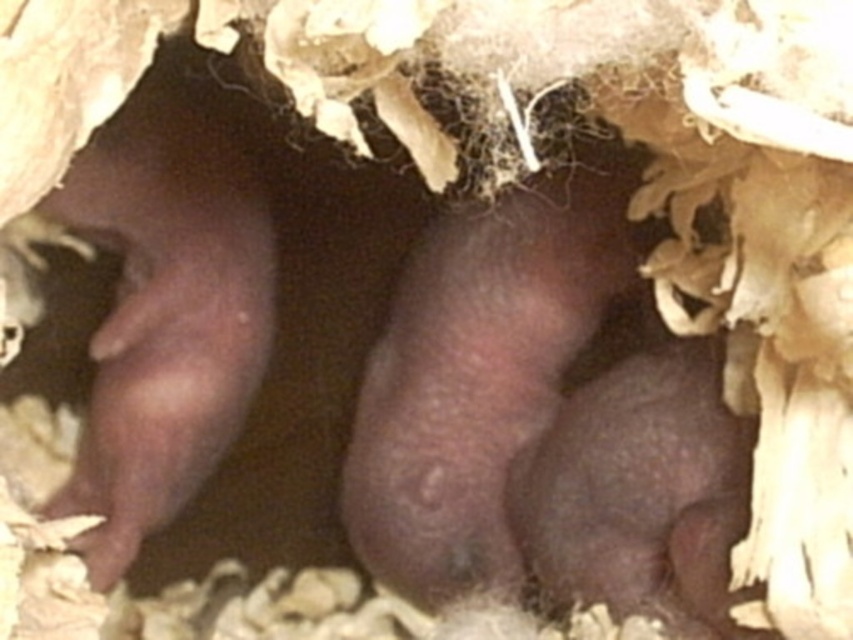
Question: Is fuzzy dark brown hamster at center in front of smooth dark brown hamster at left?

Choices:
 (A) no
 (B) yes

Answer: (B)

Question: Is smooth dark brown hamster at left to the right of fuzzy dark brown mouse at center from the viewer's perspective?

Choices:
 (A) yes
 (B) no

Answer: (B)

Question: Can you confirm if fuzzy dark brown hamster at center is wider than fuzzy dark brown mouse at center?

Choices:
 (A) yes
 (B) no

Answer: (A)

Question: Which point appears closest to the camera in this image?

Choices:
 (A) (236, 161)
 (B) (643, 388)

Answer: (B)

Question: Among these objects, which one is farthest from the camera?

Choices:
 (A) fuzzy dark brown mouse at center
 (B) smooth dark brown hamster at left

Answer: (B)

Question: Among these points, which one is farthest from the camera?

Choices:
 (A) (689, 624)
 (B) (436, 502)

Answer: (B)